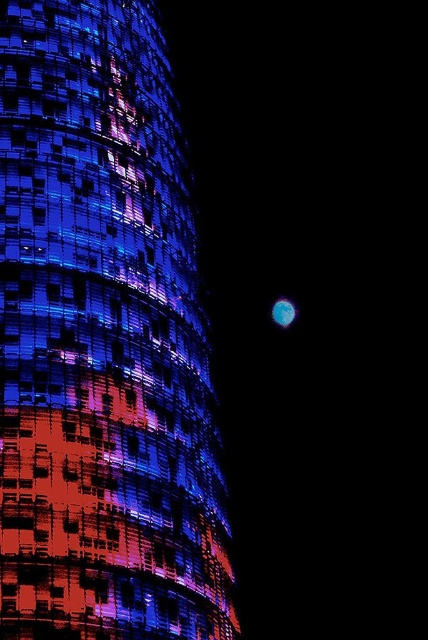
Does shiny glass tower at center appear under blue translucent sphere at right?

Actually, shiny glass tower at center is above blue translucent sphere at right.

Does shiny glass tower at center appear on the right side of blue translucent sphere at right?

In fact, shiny glass tower at center is to the left of blue translucent sphere at right.

Who is more forward, [166,243] or [284,317]?

Point [166,243]

In order to click on shiny glass tower at center in this screenshot , I will do `click(101, 339)`.